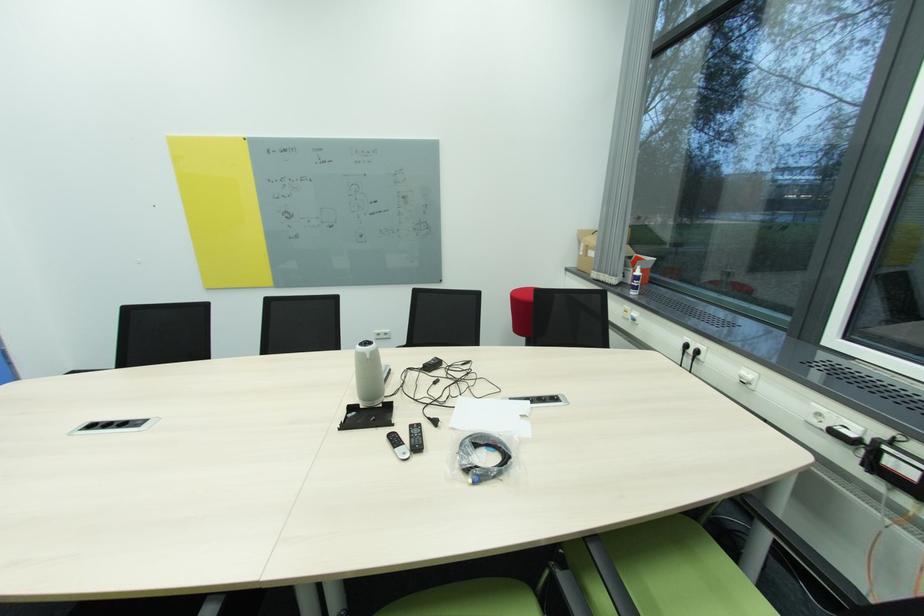
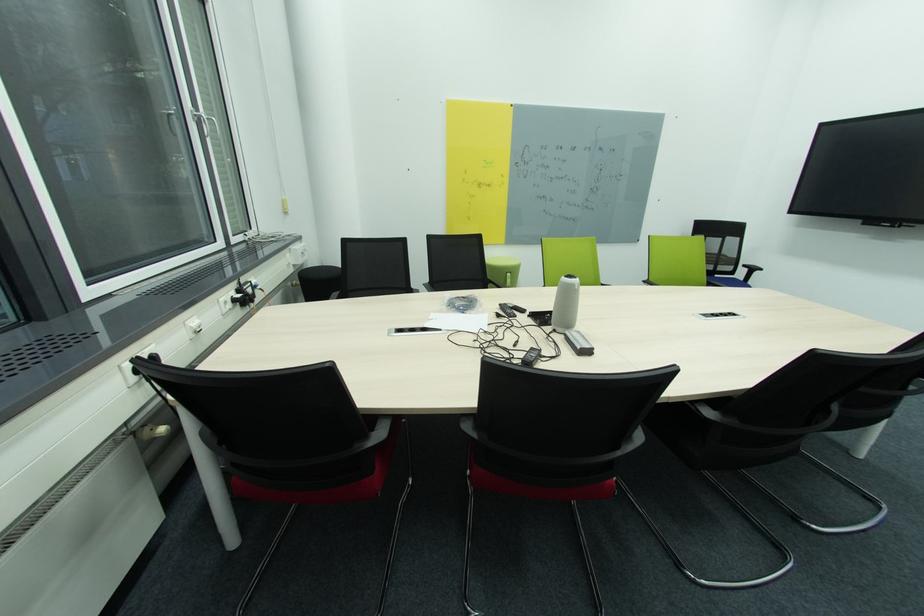
Locate, in the second image, the point that corresponds to pixel 516 400 in the first image.

(444, 331)